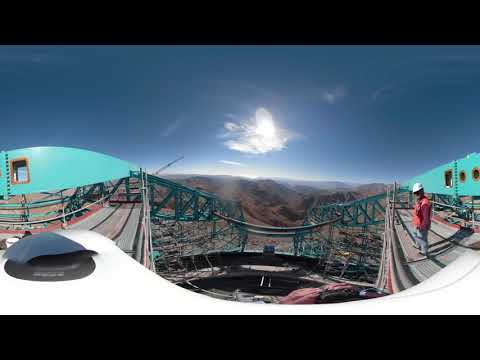
Locate an element on the screen. windows is located at coordinates (446, 174), (463, 175).